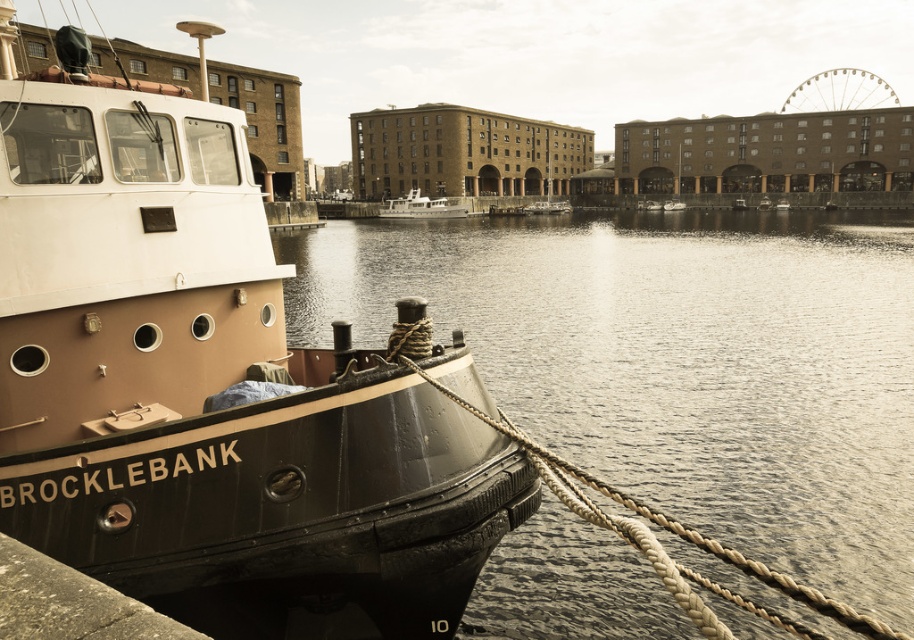
Is point (651, 509) more distant than point (541, 204)?

No.

Between point (711, 540) and point (526, 205), which one is positioned in front?

Positioned in front is point (711, 540).

Who is more forward, [731,636] or [564,202]?

Point [731,636]

I want to click on rope at left, so [x=633, y=509].

Locate an element on the screen. Image resolution: width=914 pixels, height=640 pixels. matte black boat at left is located at coordinates tap(211, 390).

Does matte black boat at left appear on the right side of white glossy boat at center?

Indeed, matte black boat at left is positioned on the right side of white glossy boat at center.

Image resolution: width=914 pixels, height=640 pixels. What do you see at coordinates (211, 390) in the screenshot? I see `matte black boat at left` at bounding box center [211, 390].

Locate an element on the screen. Image resolution: width=914 pixels, height=640 pixels. matte black boat at left is located at coordinates (211, 390).

Is point (859, 628) positioned behind point (422, 205)?

No, (859, 628) is in front of (422, 205).

Can you confirm if rope at left is positioned to the left of white glossy boat at center?

In fact, rope at left is to the right of white glossy boat at center.

Identify the location of rope at left. This screenshot has width=914, height=640. (633, 509).